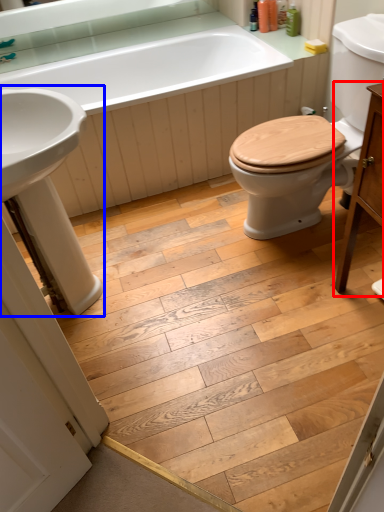
Question: Which of the following is the farthest to the observer, vanity (highlighted by a red box) or sink (highlighted by a blue box)?

Choices:
 (A) vanity
 (B) sink

Answer: (B)